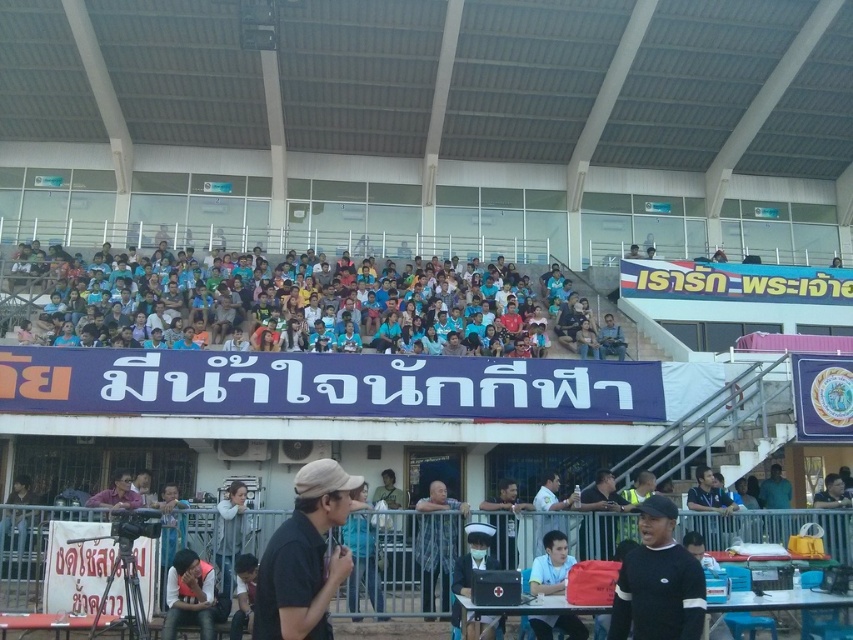
Question: Which object is the closest to the blue fabric crowd at upper center?

Choices:
 (A) white matte shirt at center
 (B) black matte shirt at center
 (C) light blue shirt at center
 (D) black matte cap at lower center

Answer: (B)

Question: Can you confirm if black matte cap at lower center is positioned above dark gray uniform at center?

Choices:
 (A) yes
 (B) no

Answer: (A)

Question: From the image, what is the correct spatial relationship of blue fabric crowd at upper center in relation to uniformed nurse at center?

Choices:
 (A) below
 (B) above

Answer: (B)

Question: Which point is farther to the camera?

Choices:
 (A) (173, 557)
 (B) (543, 627)
 (C) (434, 525)
 (D) (601, 547)

Answer: (D)

Question: Among these points, which one is farthest from the camera?

Choices:
 (A) (281, 531)
 (B) (451, 508)

Answer: (B)

Question: Observing the image, what is the correct spatial positioning of dark gray uniform at center in reference to matte black jacket at lower left?

Choices:
 (A) right
 (B) left

Answer: (A)